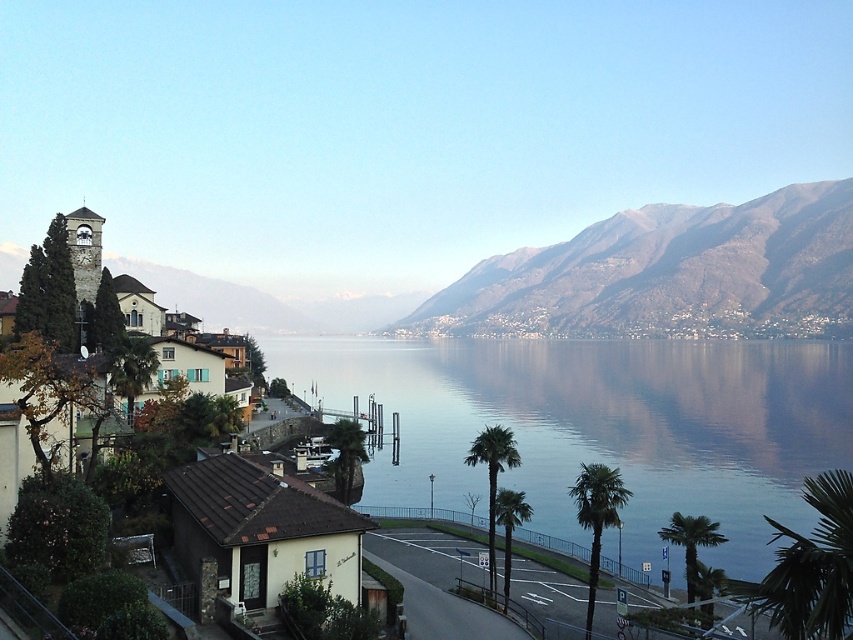
You are standing at the lakeside and want to take a photo of the green leafy palm tree at center and the gray rocky mountains at upper right. Can you see both in the same frame without moving your camera?

No, because the green leafy palm tree at center is behind the gray rocky mountains at upper right, so it would be obscured from view.

You are standing on the paved road and see the green leafy palm trees at center and the green leafy palm tree at center. Which one is positioned to the left?

The green leafy palm trees at center are to the left of the green leafy palm tree at center.